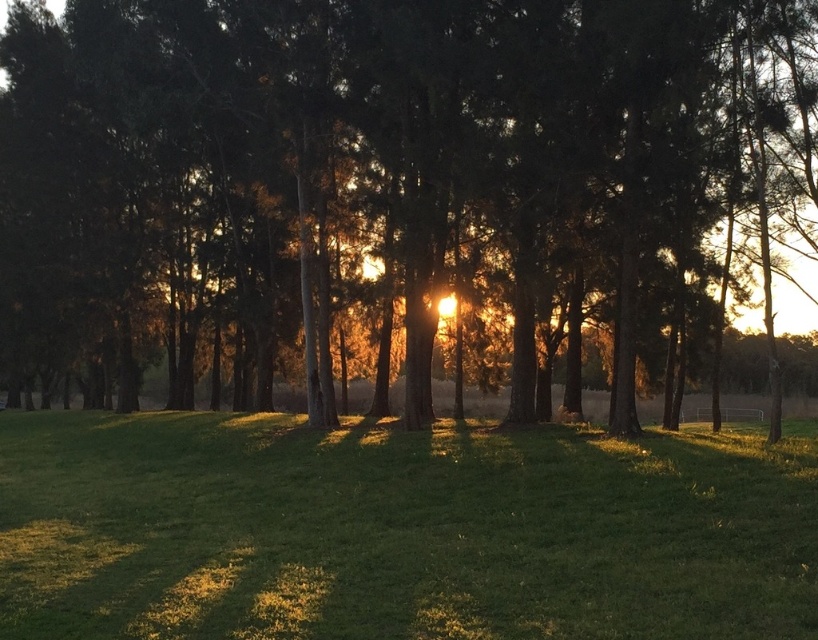
Who is positioned more to the left, green matte tree at center or green grassy field at center?

green grassy field at center is more to the left.

You are a GUI agent. You are given a task and a screenshot of the screen. Output one action in this format:
    pyautogui.click(x=<x>, y=<y>)
    Task: Click on the green matte tree at center
    The width and height of the screenshot is (818, 640).
    Given the screenshot: What is the action you would take?
    (x=389, y=180)

Who is more forward, (694, 156) or (754, 520)?

Point (754, 520) is more forward.

At what (x,y) coordinates should I click in order to perform the action: click on green matte tree at center. Please return your answer as a coordinate pair (x, y). The image size is (818, 640). Looking at the image, I should click on (389, 180).